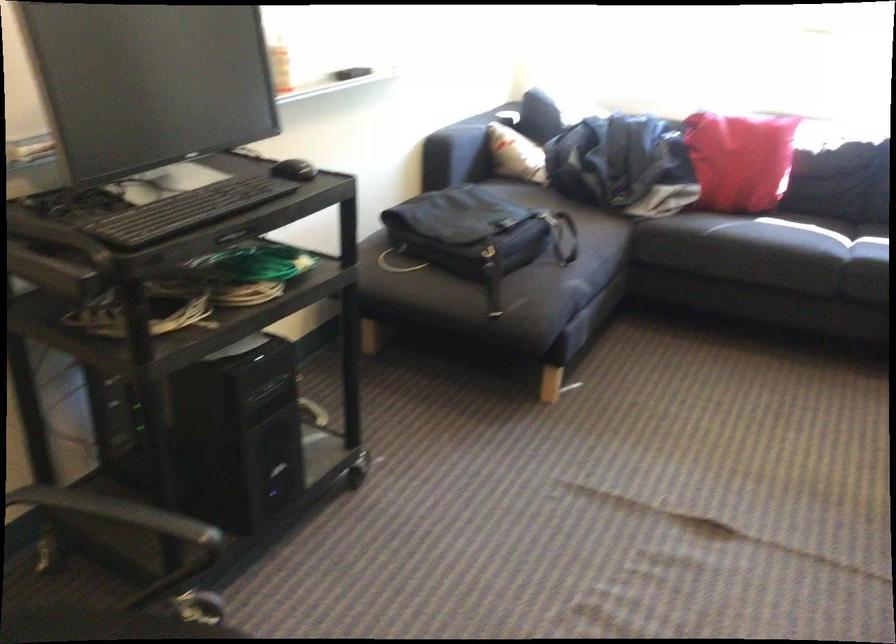
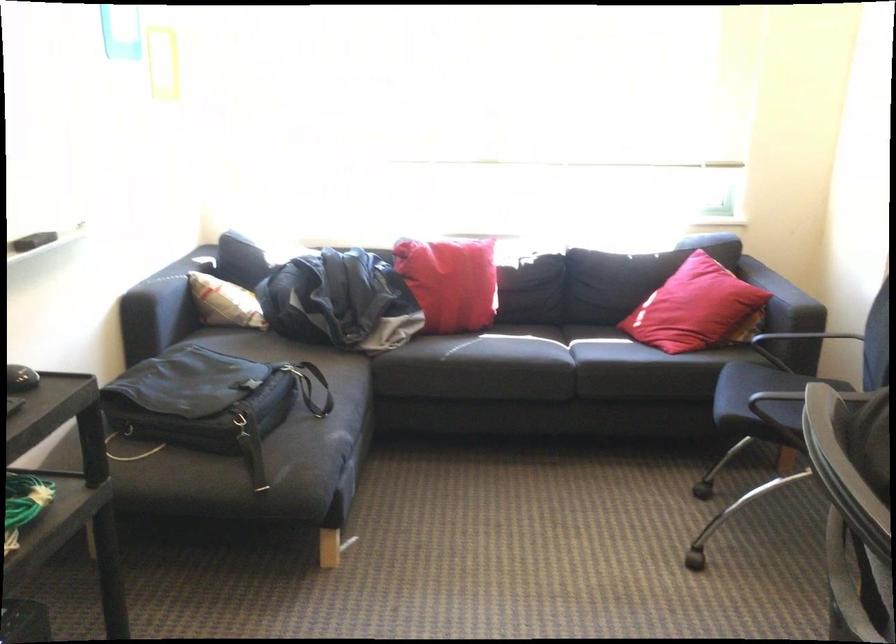
Question: The camera is either moving clockwise (left) or counter-clockwise (right) around the object. The first image is from the beginning of the video and the second image is from the end. Is the camera moving left or right when shooting the video?

Choices:
 (A) Left
 (B) Right

Answer: (A)